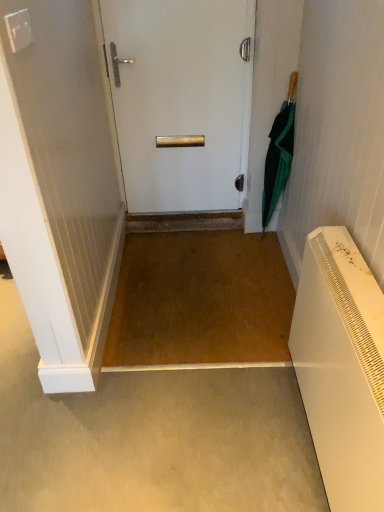
The width and height of the screenshot is (384, 512). In order to click on green fabric umbrella at right in this screenshot , I will do `click(279, 154)`.

Describe the element at coordinates (279, 154) in the screenshot. The height and width of the screenshot is (512, 384). I see `green fabric umbrella at right` at that location.

What do you see at coordinates (180, 99) in the screenshot? I see `white matte door at center` at bounding box center [180, 99].

What is the approximate height of white matte door at center?

white matte door at center is 1.29 meters in height.

Where is `white matte door at center`? The height and width of the screenshot is (512, 384). white matte door at center is located at coordinates (180, 99).

This screenshot has height=512, width=384. What are the coordinates of `green fabric umbrella at right` in the screenshot? It's located at (279, 154).

Which object is positioned more to the left, white matte door at center or green fabric umbrella at right?

Positioned to the left is white matte door at center.

Which is behind, white matte door at center or green fabric umbrella at right?

white matte door at center is further away from the camera.

Does point (128, 38) come closer to viewer compared to point (264, 215)?

Yes, point (128, 38) is in front of point (264, 215).

From the image's perspective, which one is positioned lower, white matte door at center or green fabric umbrella at right?

green fabric umbrella at right, from the image's perspective.

From a real-world perspective, does white matte door at center sit lower than green fabric umbrella at right?

Incorrect, from a real-world perspective, white matte door at center is higher than green fabric umbrella at right.

Considering the sizes of white matte door at center and green fabric umbrella at right in the image, is white matte door at center wider or thinner than green fabric umbrella at right?

In the image, white matte door at center appears to be more narrow than green fabric umbrella at right.

Considering the relative sizes of white matte door at center and green fabric umbrella at right in the image provided, is white matte door at center shorter than green fabric umbrella at right?

No.

Can you confirm if white matte door at center is smaller than green fabric umbrella at right?

No.

Do you think white matte door at center is within green fabric umbrella at right, or outside of it?

→ white matte door at center is not enclosed by green fabric umbrella at right.

Is white matte door at center directly adjacent to green fabric umbrella at right?

white matte door at center and green fabric umbrella at right are clearly separated.

Is green fabric umbrella at right at the back of white matte door at center?

white matte door at center does not have its back to green fabric umbrella at right.

Find the location of a particular element. This screenshot has width=384, height=512. door on the left of green fabric umbrella at right is located at coordinates 180,99.

Consider the image. Is green fabric umbrella at right to the left of white matte door at center from the viewer's perspective?

No.

In the scene shown: Is green fabric umbrella at right behind white matte door at center?

No, green fabric umbrella at right is closer to the camera.

Does point (289, 117) lie in front of point (225, 71)?

Yes, point (289, 117) is closer to viewer.

From the image's perspective, is green fabric umbrella at right above white matte door at center?

No.

From a real-world perspective, is green fabric umbrella at right located higher than white matte door at center?

No, from a real-world perspective, green fabric umbrella at right is not over white matte door at center

Does green fabric umbrella at right have a greater width compared to white matte door at center?

Indeed, green fabric umbrella at right has a greater width compared to white matte door at center.

Who is shorter, green fabric umbrella at right or white matte door at center?

Standing shorter between the two is green fabric umbrella at right.

In terms of size, does green fabric umbrella at right appear bigger or smaller than white matte door at center?

Clearly, green fabric umbrella at right is smaller in size than white matte door at center.

Based on the photo, can white matte door at center be found inside green fabric umbrella at right?

No, white matte door at center is not inside green fabric umbrella at right.

Is green fabric umbrella at right next to white matte door at center?

No, green fabric umbrella at right is not next to white matte door at center.

Does green fabric umbrella at right turn towards white matte door at center?

No, green fabric umbrella at right is not turned towards white matte door at center.

How many degrees apart are the facing directions of green fabric umbrella at right and white matte door at center?

The facing directions of green fabric umbrella at right and white matte door at center are 32.2 degrees apart.

Where is `door located above the green fabric umbrella at right (from the image's perspective)`? The width and height of the screenshot is (384, 512). door located above the green fabric umbrella at right (from the image's perspective) is located at coordinates (180, 99).

Image resolution: width=384 pixels, height=512 pixels. Identify the location of umbrella in front of the white matte door at center. (279, 154).

You are a GUI agent. You are given a task and a screenshot of the screen. Output one action in this format:
    pyautogui.click(x=<x>, y=<y>)
    Task: Click on the umbrella lying on the right of white matte door at center
    
    Given the screenshot: What is the action you would take?
    pyautogui.click(x=279, y=154)